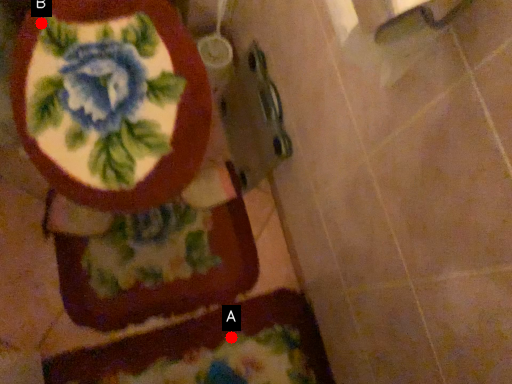
Question: Two points are circled on the image, labeled by A and B beside each circle. Which point is farther from the camera taking this photo?

Choices:
 (A) A is further
 (B) B is further

Answer: (A)